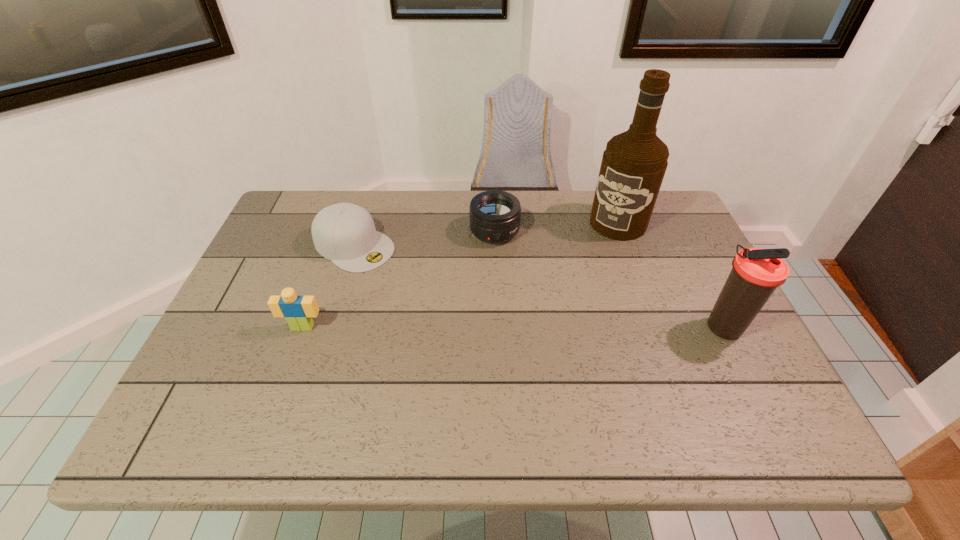
Find the location of a particular element. Image resolution: width=960 pixels, height=540 pixels. vacant area that lies between the fourth object from left to right and the rightmost object is located at coordinates (670, 275).

I want to click on vacant area that lies between the third tallest object and the rightmost object, so click(513, 327).

Locate an element on the screen. free space between the third shortest object and the rightmost object is located at coordinates (513, 327).

Select which object is the fourth closest to the third tallest object. Please provide its 2D coordinates. Your answer should be formatted as a tuple, i.e. [(x, y)], where the tuple contains the x and y coordinates of a point satisfying the conditions above.

[(756, 273)]

In order to click on the closest object to the telephoto lens in this screenshot , I will do `click(345, 233)`.

The height and width of the screenshot is (540, 960). I want to click on vacant area that satisfies the following two spatial constraints: 1. on the front side of the thermos bottle; 2. on the right side of the cap, so click(329, 327).

Identify the location of blank area in the image that satisfies the following two spatial constraints: 1. on the back side of the alcohol; 2. on the right side of the telephoto lens. This screenshot has width=960, height=540. (494, 223).